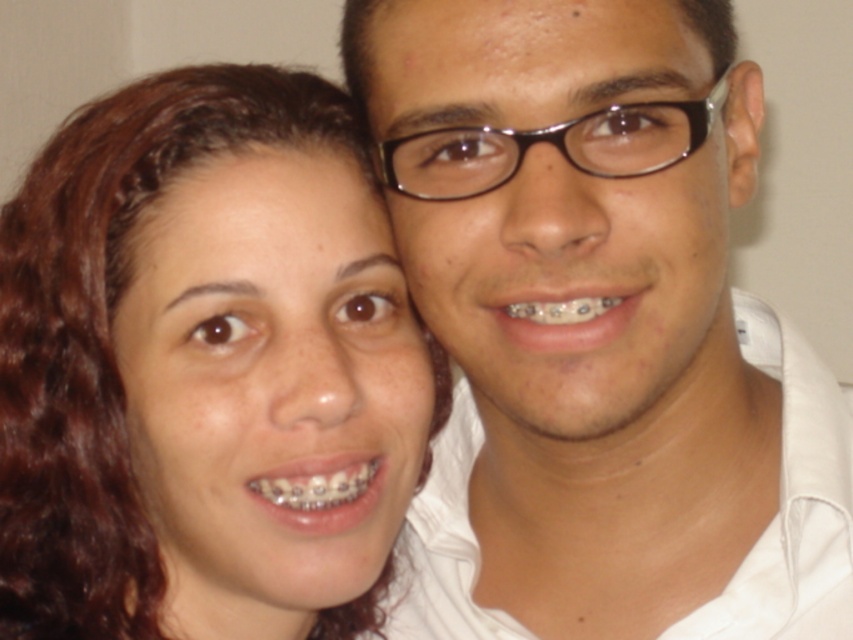
Question: Estimate the real-world distances between objects in this image. Which object is farther from the metallic braces at lower center?

Choices:
 (A) matte skin at center
 (B) matte black glasses at center

Answer: (B)

Question: Does metallic braces at center have a larger size compared to metallic braces at lower center?

Choices:
 (A) no
 (B) yes

Answer: (A)

Question: Can you confirm if matte black glasses at center is wider than metallic braces at center?

Choices:
 (A) no
 (B) yes

Answer: (B)

Question: Which of the following is the farthest from the observer?

Choices:
 (A) matte skin at center
 (B) metallic braces at center
 (C) matte black glasses at center
 (D) metallic braces at lower center

Answer: (D)

Question: Is matte black glasses at center further to camera compared to matte skin at center?

Choices:
 (A) yes
 (B) no

Answer: (B)

Question: Which point is closer to the camera?

Choices:
 (A) metallic braces at lower center
 (B) matte skin at center
 (C) matte black glasses at center

Answer: (C)